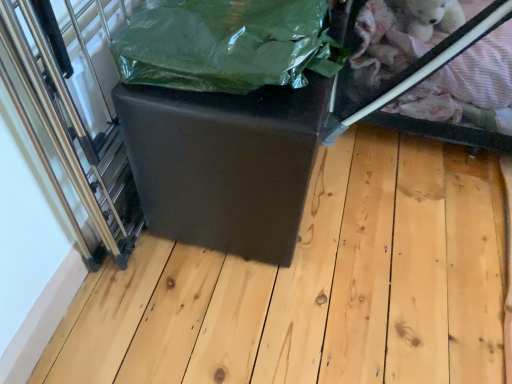
Question: Is green plastic bag at center further to camera compared to transparent plastic glass door at left?

Choices:
 (A) no
 (B) yes

Answer: (B)

Question: Considering the relative sizes of green plastic bag at center and transparent plastic glass door at left in the image provided, is green plastic bag at center wider than transparent plastic glass door at left?

Choices:
 (A) no
 (B) yes

Answer: (B)

Question: From the image's perspective, would you say green plastic bag at center is positioned over transparent plastic glass door at left?

Choices:
 (A) yes
 (B) no

Answer: (A)

Question: Is green plastic bag at center taller than transparent plastic glass door at left?

Choices:
 (A) no
 (B) yes

Answer: (A)

Question: Considering the relative sizes of green plastic bag at center and transparent plastic glass door at left in the image provided, is green plastic bag at center shorter than transparent plastic glass door at left?

Choices:
 (A) yes
 (B) no

Answer: (A)

Question: From a real-world perspective, is green plastic bag at center below transparent plastic glass door at left?

Choices:
 (A) yes
 (B) no

Answer: (B)

Question: Are transparent plastic glass box at upper right and green plastic bag at center located far from each other?

Choices:
 (A) no
 (B) yes

Answer: (A)

Question: Can you confirm if transparent plastic glass box at upper right is positioned to the right of green plastic bag at center?

Choices:
 (A) no
 (B) yes

Answer: (B)

Question: Can you confirm if transparent plastic glass box at upper right is taller than green plastic bag at center?

Choices:
 (A) no
 (B) yes

Answer: (B)

Question: From the image's perspective, is transparent plastic glass box at upper right beneath green plastic bag at center?

Choices:
 (A) yes
 (B) no

Answer: (B)

Question: Does transparent plastic glass box at upper right have a lesser height compared to green plastic bag at center?

Choices:
 (A) yes
 (B) no

Answer: (B)

Question: Is transparent plastic glass box at upper right next to green plastic bag at center?

Choices:
 (A) yes
 (B) no

Answer: (B)

Question: From the image's perspective, is matte black ottoman at center under transparent plastic glass box at upper right?

Choices:
 (A) no
 (B) yes

Answer: (B)